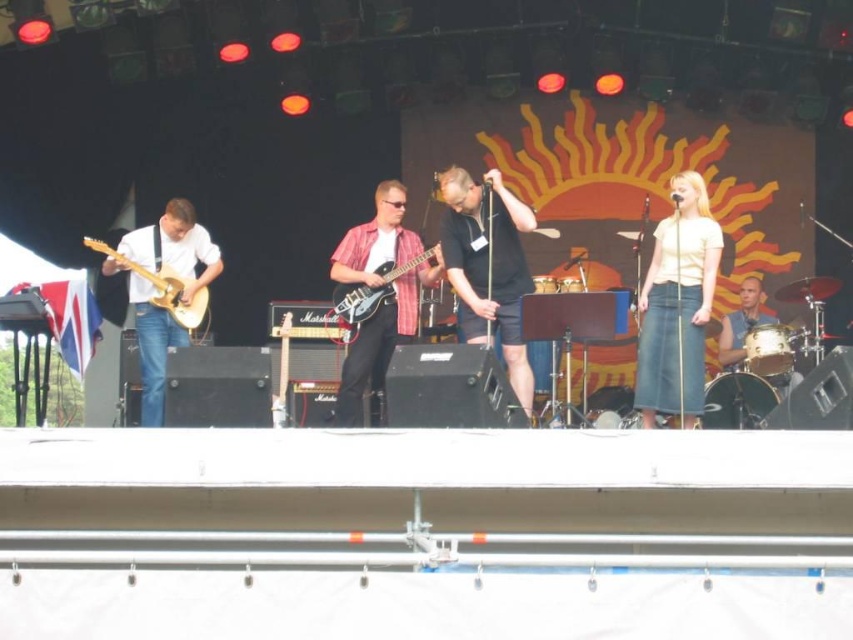
Question: Does plaid shirt guitar at center come behind matte wood guitar at left?

Choices:
 (A) no
 (B) yes

Answer: (B)

Question: Which object is positioned farthest from the matte black shorts at center?

Choices:
 (A) matte wood guitar at left
 (B) matte black electric guitar at center
 (C) shiny silver drum at right

Answer: (A)

Question: Can you confirm if matte black shorts at center is positioned to the left of matte black electric guitar at center?

Choices:
 (A) no
 (B) yes

Answer: (A)

Question: Estimate the real-world distances between objects in this image. Which object is closer to the shiny silver drum at right?

Choices:
 (A) white denim skirt at right
 (B) light brown wood electric guitar at left

Answer: (A)

Question: Does white denim skirt at right appear on the right side of matte wood guitar at left?

Choices:
 (A) no
 (B) yes

Answer: (B)

Question: Based on their relative distances, which object is nearer to the matte black guitar at left?

Choices:
 (A) shiny silver drum at right
 (B) light brown wood electric guitar at left

Answer: (A)